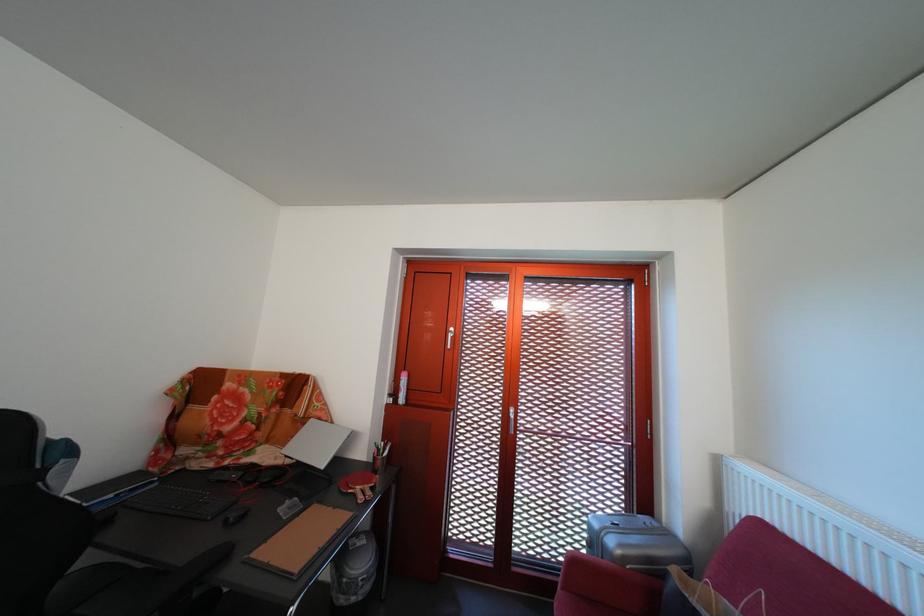
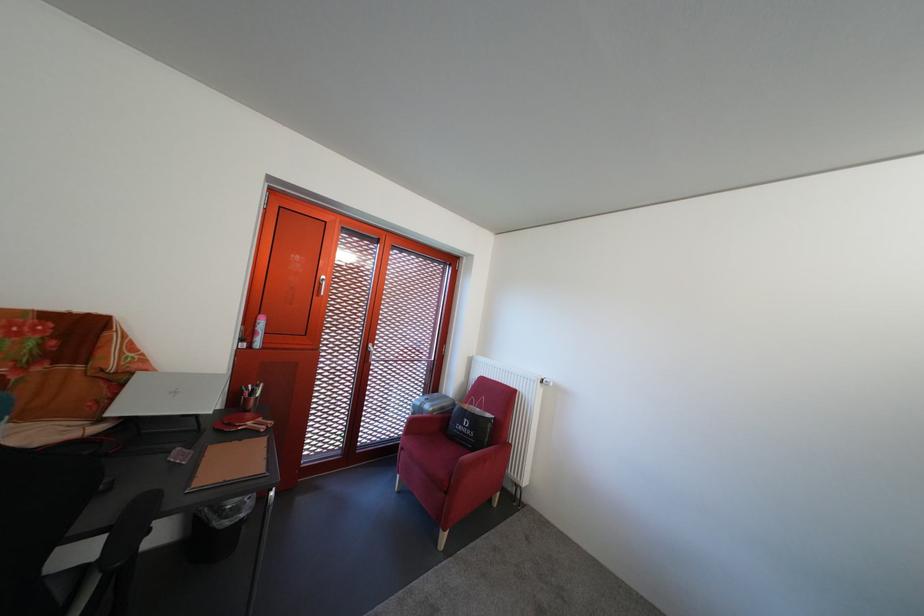
The point at (386, 477) is marked in the first image. Where is the corresponding point in the second image?

(260, 418)